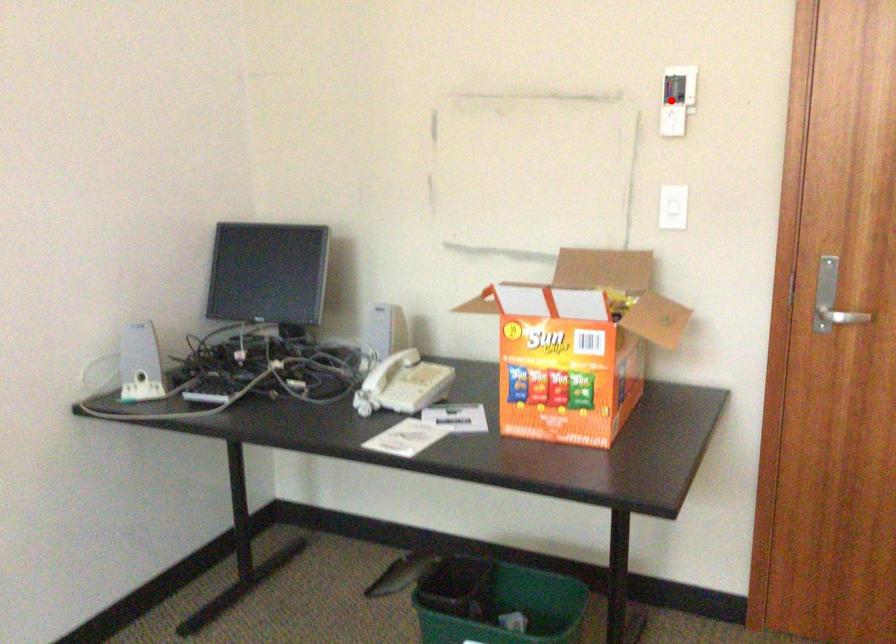
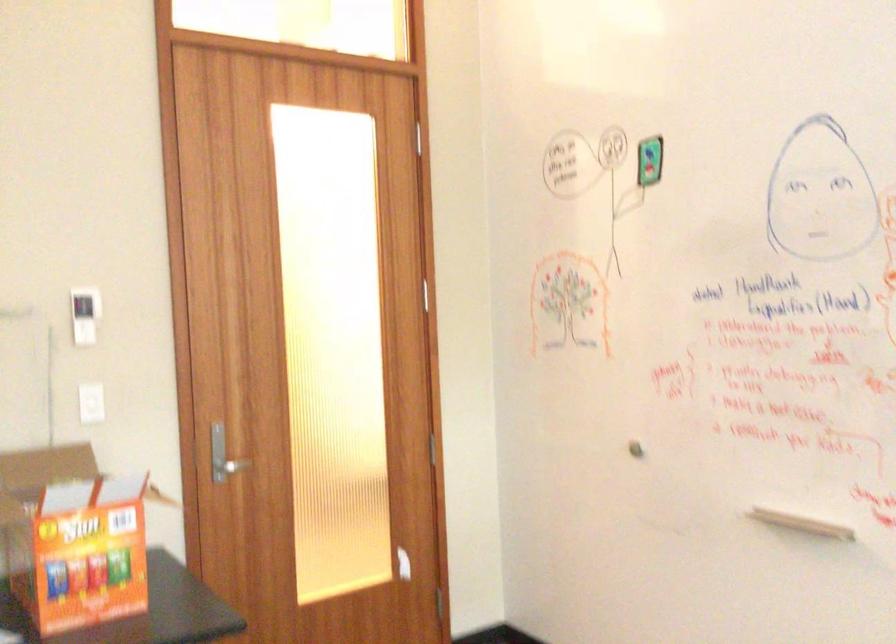
Where in the second image is the point corresponding to the highlighted location from the first image?

(84, 315)